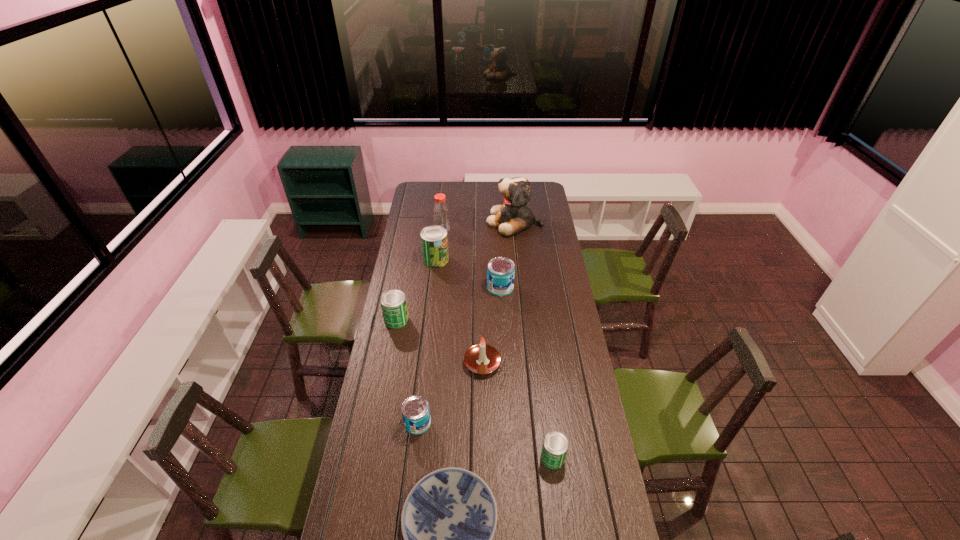
The width and height of the screenshot is (960, 540). I want to click on green can that is the second nearest to the farther blue can, so 393,303.

This screenshot has height=540, width=960. What are the coordinates of `green can identified as the second closest to the second farthest green can` in the screenshot? It's located at (555, 445).

Where is `vacant position in the image that satisfies the following two spatial constraints: 1. at the face of the tallest object; 2. on the front side of the leftmost green can`? The image size is (960, 540). vacant position in the image that satisfies the following two spatial constraints: 1. at the face of the tallest object; 2. on the front side of the leftmost green can is located at coordinates (524, 320).

Where is `vacant point that satisfies the following two spatial constraints: 1. on the back side of the tallest can; 2. on the right side of the leftmost object`? vacant point that satisfies the following two spatial constraints: 1. on the back side of the tallest can; 2. on the right side of the leftmost object is located at coordinates (408, 259).